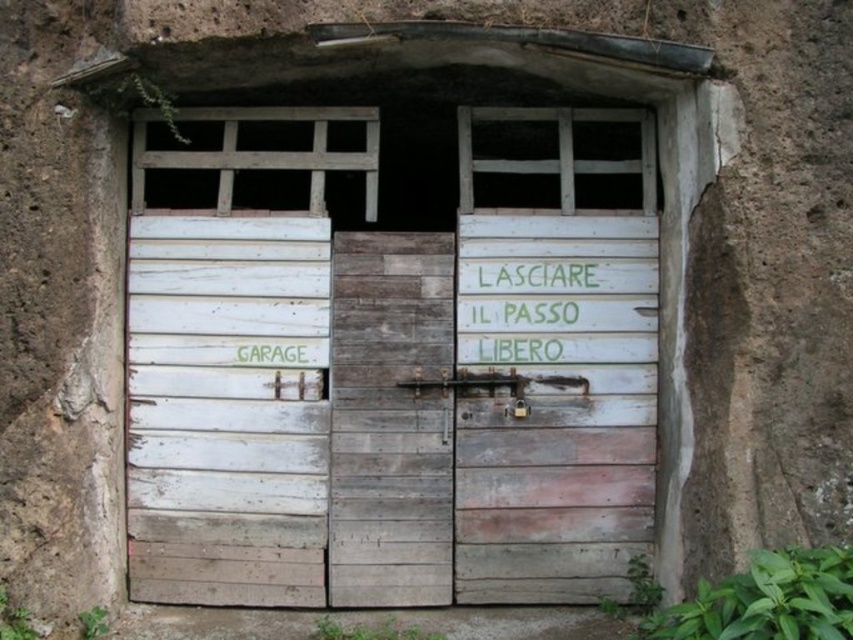
Is white weathered wood door at center shorter than white painted wood at center?

Incorrect, white weathered wood door at center's height does not fall short of white painted wood at center's.

The height and width of the screenshot is (640, 853). In order to click on white weathered wood door at center in this screenshot , I will do `click(555, 404)`.

Is weathered wood door at center bigger than green painted wood sign at center?

Indeed, weathered wood door at center has a larger size compared to green painted wood sign at center.

Image resolution: width=853 pixels, height=640 pixels. Describe the element at coordinates (389, 420) in the screenshot. I see `weathered wood door at center` at that location.

You are a GUI agent. You are given a task and a screenshot of the screen. Output one action in this format:
    pyautogui.click(x=<x>, y=<y>)
    Task: Click on the weathered wood door at center
    
    Given the screenshot: What is the action you would take?
    pyautogui.click(x=389, y=420)

Is white weathered wood garage door at center further to the viewer compared to weathered wood door at center?

No, white weathered wood garage door at center is closer to the viewer.

Between white weathered wood garage door at center and weathered wood door at center, which one appears on the left side from the viewer's perspective?

Positioned to the left is white weathered wood garage door at center.

Locate an element on the screen. This screenshot has width=853, height=640. white weathered wood garage door at center is located at coordinates (392, 401).

You are a GUI agent. You are given a task and a screenshot of the screen. Output one action in this format:
    pyautogui.click(x=<x>, y=<y>)
    Task: Click on the white weathered wood garage door at center
    This screenshot has height=640, width=853.
    Given the screenshot: What is the action you would take?
    pyautogui.click(x=392, y=401)